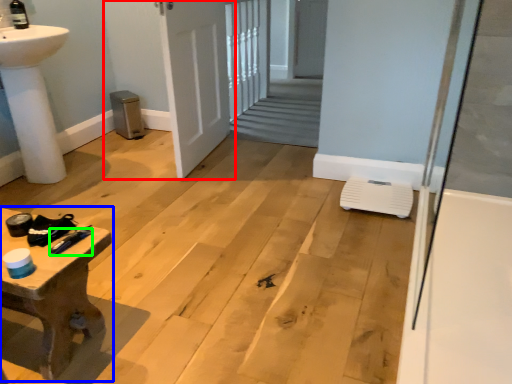
Question: Considering the real-world distances, which object is closest to door (highlighted by a red box)? table (highlighted by a blue box) or tool (highlighted by a green box).

Choices:
 (A) table
 (B) tool

Answer: (A)